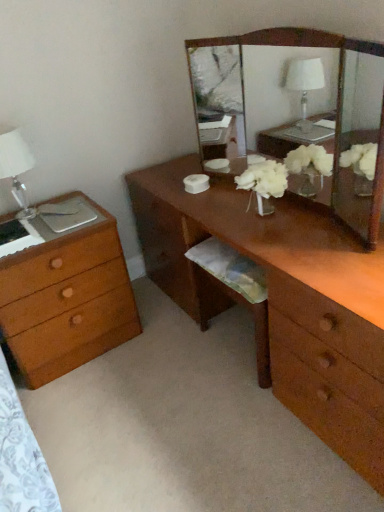
What are the coordinates of `vacant area in front of wooden mirror at center` in the screenshot? It's located at (300, 249).